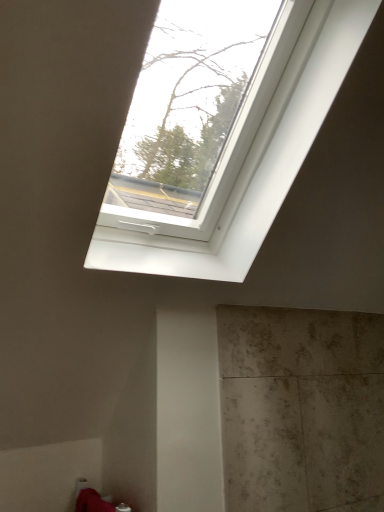
Locate an element on the screen. This screenshot has height=512, width=384. white plastic window at upper center is located at coordinates (251, 162).

Describe the element at coordinates (251, 162) in the screenshot. I see `white plastic window at upper center` at that location.

Locate an element on the screen. white plastic window at upper center is located at coordinates (251, 162).